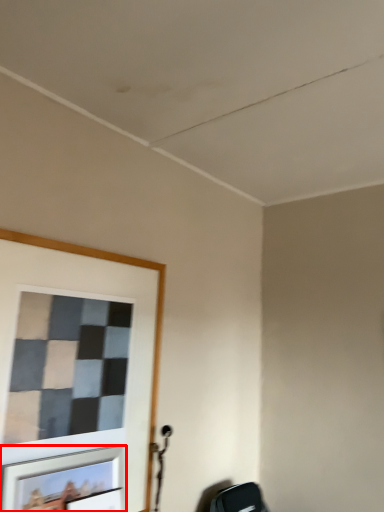
Question: Considering the relative positions of picture frame (annotated by the red box) and picture frame in the image provided, where is picture frame (annotated by the red box) located with respect to the staircase?

Choices:
 (A) right
 (B) left

Answer: (B)